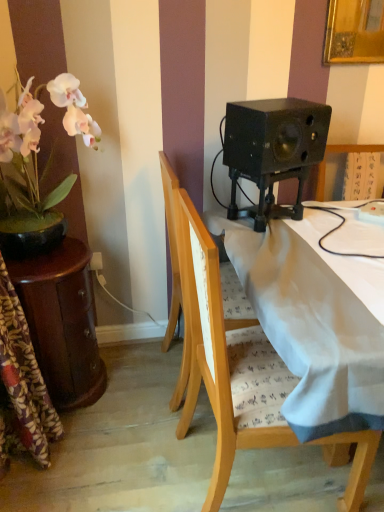
At what (x,y) coordinates should I click in order to perform the action: click on vacant space situated on the left part of wooden chair at center, the 1th chair positioned from the front. Please return your answer as a coordinate pair (x, y). This screenshot has height=512, width=384. Looking at the image, I should click on (149, 473).